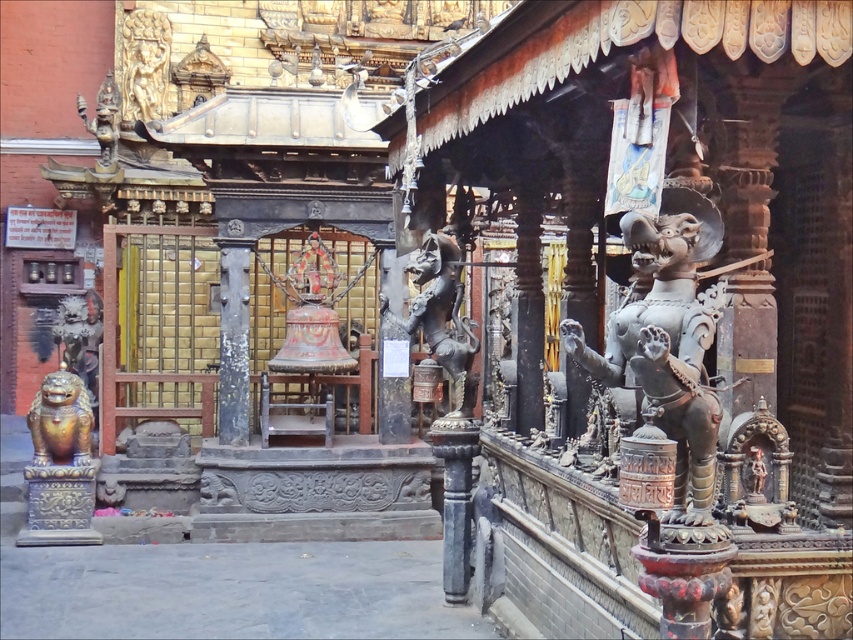
You are a temple visitor who wants to place a flower offering between the polished bronze statue at right and the golden stone statue at upper left. The flower offering requires a space of 15 meters. Is there enough space between them to place it?

The distance between the polished bronze statue at right and the golden stone statue at upper left is 15.11 meters, which is just enough to accommodate the 15 meters required for the flower offering.

You are standing in front of a traditional temple and want to place a 1.5 meter long ritual cloth on the polished bronze statue at right. Considering your current position, can you reach the statue to place the cloth without moving closer?

The distance between you and the polished bronze statue at right is 4.40 meters. Since the statue is 4.40 meters away, reaching it with a 1.5 meter cloth would not be possible without moving closer.

You are a temple visitor who wants to place a flower offering between the polished bronze statue at right and the gold polished lion at lower left. The flower offering requires a space of 9 meters. Is there enough space between them?

The distance between the polished bronze statue at right and the gold polished lion at lower left is 8.81 meters. Since the required space is 9 meters, there is not enough space to place the flower offering between them.